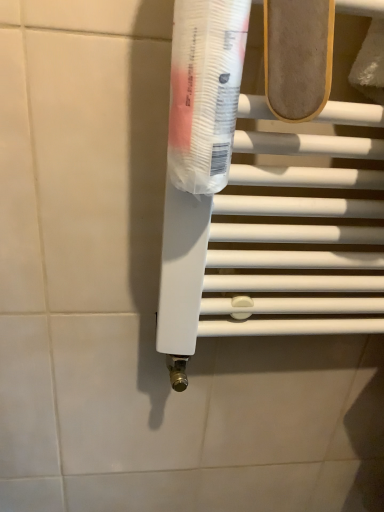
Locate an element on the screen. white plastic towel bar at center is located at coordinates (263, 268).

Identify the location of light brown suede shoe at upper center. (298, 56).

From the image's perspective, who appears lower, white plastic towel bar at center or transparent plastic tube at center?

white plastic towel bar at center is shown below in the image.

Can you confirm if white plastic towel bar at center is thinner than transparent plastic tube at center?

Correct, the width of white plastic towel bar at center is less than that of transparent plastic tube at center.

Find the location of a particular element. The width and height of the screenshot is (384, 512). toothpaste above the white plastic towel bar at center (from the image's perspective) is located at coordinates (205, 91).

Is point (266, 51) positioned before point (230, 152)?

Yes, it is in front of point (230, 152).

Between light brown suede shoe at upper center and transparent plastic tube at center, which one has larger size?

Bigger between the two is transparent plastic tube at center.

From a real-world perspective, is light brown suede shoe at upper center positioned over transparent plastic tube at center based on gravity?

Correct, in the physical world, light brown suede shoe at upper center is higher than transparent plastic tube at center.

Consider the image. How distant is transparent plastic tube at center from white plastic towel bar at center?

transparent plastic tube at center is 5.65 inches from white plastic towel bar at center.

Is transparent plastic tube at center next to white plastic towel bar at center?

No, transparent plastic tube at center is not next to white plastic towel bar at center.

Which point is more forward, (206, 69) or (271, 70)?

The point (206, 69) is closer to the camera.

Does transparent plastic tube at center turn towards white plastic towel bar at center?

No, transparent plastic tube at center does not turn towards white plastic towel bar at center.

From the image's perspective, is white plastic towel bar at center positioned above or below light brown suede shoe at upper center?

From the image's perspective, white plastic towel bar at center appears below light brown suede shoe at upper center.

Considering the sizes of white plastic towel bar at center and light brown suede shoe at upper center in the image, is white plastic towel bar at center taller or shorter than light brown suede shoe at upper center?

In the image, white plastic towel bar at center appears to be taller than light brown suede shoe at upper center.

Would you say white plastic towel bar at center is a long distance from light brown suede shoe at upper center?

No, there isn't a large distance between white plastic towel bar at center and light brown suede shoe at upper center.

Based on the photo, is light brown suede shoe at upper center looking in the opposite direction of white plastic towel bar at center?

No, white plastic towel bar at center is not at the back of light brown suede shoe at upper center.

From the image's perspective, between light brown suede shoe at upper center and white plastic towel bar at center, who is located below?

white plastic towel bar at center.

Which is more to the left, light brown suede shoe at upper center or white plastic towel bar at center?

From the viewer's perspective, light brown suede shoe at upper center appears more on the left side.

Is light brown suede shoe at upper center beside white plastic towel bar at center?

light brown suede shoe at upper center is not next to white plastic towel bar at center, and they're not touching.

In the scene shown: Are transparent plastic tube at center and light brown suede shoe at upper center far apart?

No, transparent plastic tube at center is in close proximity to light brown suede shoe at upper center.

Consider the image. From a real-world perspective, which object stands above the other?

light brown suede shoe at upper center.

How different are the orientations of transparent plastic tube at center and light brown suede shoe at upper center in degrees?

0.00785 degrees separate the facing orientations of transparent plastic tube at center and light brown suede shoe at upper center.

In the image, is transparent plastic tube at center positioned in front of or behind light brown suede shoe at upper center?

Clearly, transparent plastic tube at center is in front of light brown suede shoe at upper center.

You are a GUI agent. You are given a task and a screenshot of the screen. Output one action in this format:
    pyautogui.click(x=<x>, y=<y>)
    Task: Click on the towel bar below the transparent plastic tube at center (from a real-world perspective)
    
    Given the screenshot: What is the action you would take?
    pyautogui.click(x=263, y=268)

This screenshot has width=384, height=512. Find the location of `toothpaste that appears below the light brown suede shoe at upper center (from the image's perspective)`. toothpaste that appears below the light brown suede shoe at upper center (from the image's perspective) is located at coordinates (205, 91).

Estimate the real-world distances between objects in this image. Which object is further from light brown suede shoe at upper center, transparent plastic tube at center or white plastic towel bar at center?

Among the two, white plastic towel bar at center is located further to light brown suede shoe at upper center.

Based on their spatial positions, is white plastic towel bar at center or transparent plastic tube at center further from light brown suede shoe at upper center?

white plastic towel bar at center is positioned further to the anchor light brown suede shoe at upper center.

From the image, which object appears to be nearer to transparent plastic tube at center, light brown suede shoe at upper center or white plastic towel bar at center?

Among the two, light brown suede shoe at upper center is located nearer to transparent plastic tube at center.

From the image, which object appears to be farther from white plastic towel bar at center, transparent plastic tube at center or light brown suede shoe at upper center?

Among the two, light brown suede shoe at upper center is located further to white plastic towel bar at center.

Looking at the image, which one is located further to transparent plastic tube at center, white plastic towel bar at center or light brown suede shoe at upper center?

Among the two, white plastic towel bar at center is located further to transparent plastic tube at center.

Considering their positions, is light brown suede shoe at upper center positioned closer to white plastic towel bar at center than transparent plastic tube at center?

The object closer to white plastic towel bar at center is transparent plastic tube at center.

Image resolution: width=384 pixels, height=512 pixels. In order to click on toothpaste between light brown suede shoe at upper center and white plastic towel bar at center in the up-down direction in this screenshot , I will do `click(205, 91)`.